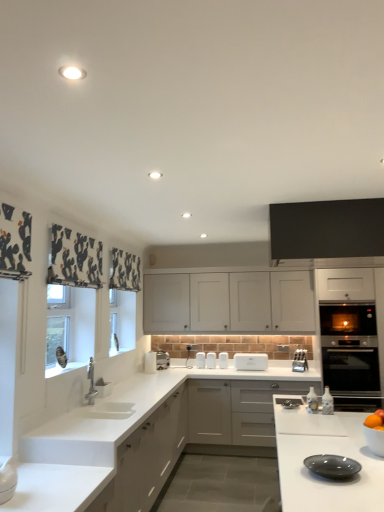
Image resolution: width=384 pixels, height=512 pixels. Identify the location of free space in front of matte gray plate at lower right. (343, 496).